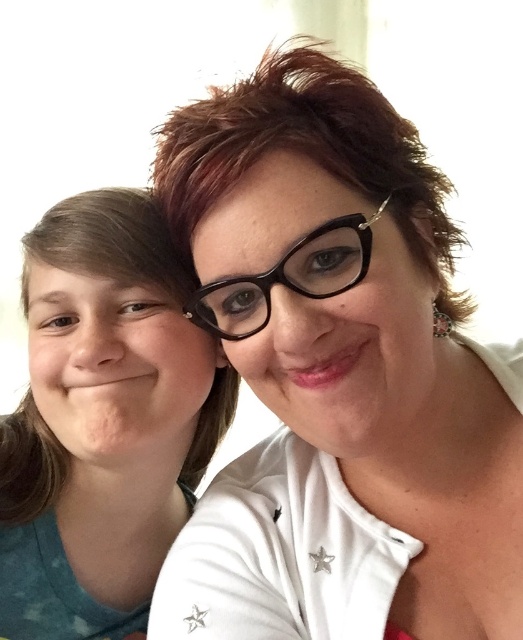
Question: Which of these objects is positioned closest to the black plastic glasses at center?

Choices:
 (A) teal fabric shirt at left
 (B) matte black glasses at upper center

Answer: (B)

Question: Is matte black glasses at upper center positioned before teal fabric shirt at left?

Choices:
 (A) yes
 (B) no

Answer: (A)

Question: Can you confirm if matte black glasses at upper center is positioned to the left of teal fabric shirt at left?

Choices:
 (A) yes
 (B) no

Answer: (B)

Question: Among these points, which one is farthest from the camera?

Choices:
 (A) (219, 289)
 (B) (389, 330)
 (C) (39, 600)

Answer: (C)

Question: Among these points, which one is farthest from the camera?

Choices:
 (A) 172,259
 (B) 315,273

Answer: (A)

Question: Can you confirm if teal fabric shirt at left is positioned below black plastic glasses at center?

Choices:
 (A) no
 (B) yes

Answer: (B)